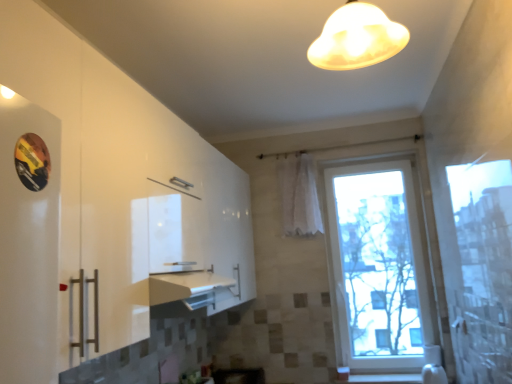
Question: Considering the relative sizes of white sheer curtain at center and transparent glass window at center in the image provided, is white sheer curtain at center shorter than transparent glass window at center?

Choices:
 (A) yes
 (B) no

Answer: (A)

Question: Considering the relative sizes of white sheer curtain at center and transparent glass window at center in the image provided, is white sheer curtain at center wider than transparent glass window at center?

Choices:
 (A) yes
 (B) no

Answer: (B)

Question: Does white sheer curtain at center have a smaller size compared to transparent glass window at center?

Choices:
 (A) no
 (B) yes

Answer: (B)

Question: Can you confirm if white sheer curtain at center is positioned to the right of transparent glass window at center?

Choices:
 (A) no
 (B) yes

Answer: (A)

Question: Can you confirm if white sheer curtain at center is thinner than transparent glass window at center?

Choices:
 (A) yes
 (B) no

Answer: (A)

Question: Is white sheer curtain at center beside transparent glass window at center?

Choices:
 (A) yes
 (B) no

Answer: (B)

Question: From a real-world perspective, is transparent glass window at center beneath white sheer curtain at center?

Choices:
 (A) yes
 (B) no

Answer: (A)

Question: Is transparent glass window at center not inside white sheer curtain at center?

Choices:
 (A) no
 (B) yes

Answer: (B)

Question: Considering the relative sizes of transparent glass window at center and white sheer curtain at center in the image provided, is transparent glass window at center wider than white sheer curtain at center?

Choices:
 (A) no
 (B) yes

Answer: (B)

Question: Are transparent glass window at center and white sheer curtain at center located far from each other?

Choices:
 (A) no
 (B) yes

Answer: (A)

Question: Does transparent glass window at center have a lesser width compared to white sheer curtain at center?

Choices:
 (A) yes
 (B) no

Answer: (B)

Question: Is the position of transparent glass window at center more distant than that of white sheer curtain at center?

Choices:
 (A) yes
 (B) no

Answer: (B)

Question: Does matte glass lampshade at upper center have a lesser width compared to transparent glass window at center?

Choices:
 (A) no
 (B) yes

Answer: (A)